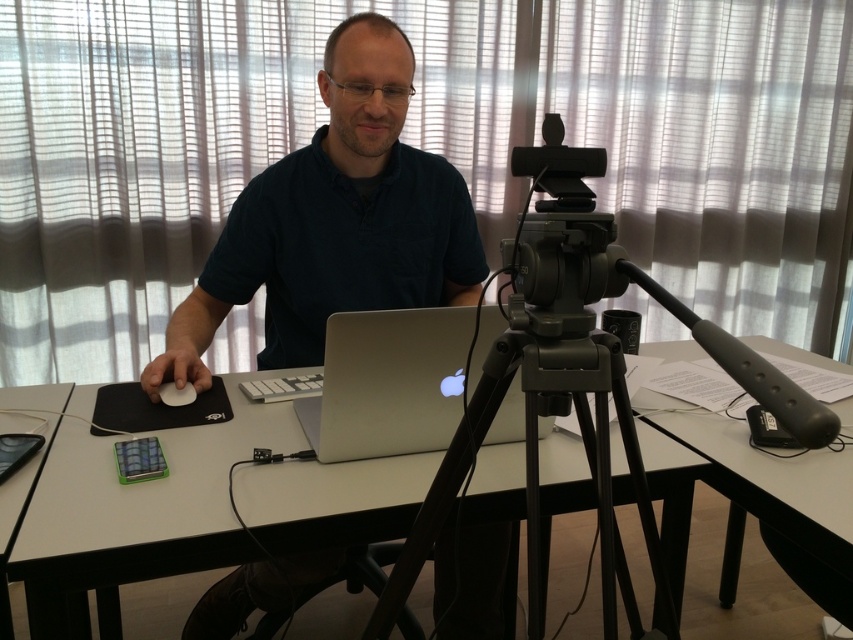
Please provide the coordinates of the white matte table at center in the image.

The white matte table at center is located at coordinates point (137, 509).

Based on the coordinates provided, what object is located at point (137, 509) in the workspace setup?

The point (137, 509) corresponds to the white matte table at center.

You are setting up a camera on the black matte tripod at center and need to place it next to the white plastic table at right. Considering their heights, which object will have its top surface higher when placed side by side?

The black matte tripod at center has a greater height compared to the white plastic table at right, so its top surface will be higher when placed side by side.